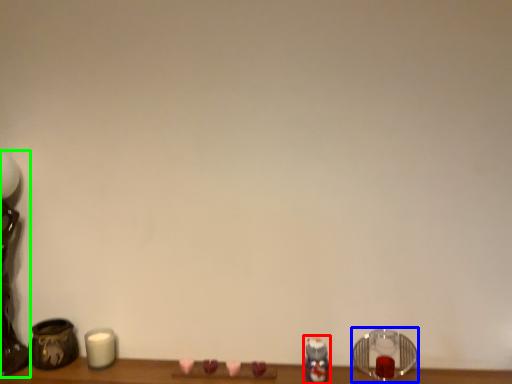
Question: Considering the real-world distances, which object is closest to toy (highlighted by a red box)? candle holder (highlighted by a blue box) or table lamp (highlighted by a green box).

Choices:
 (A) candle holder
 (B) table lamp

Answer: (A)